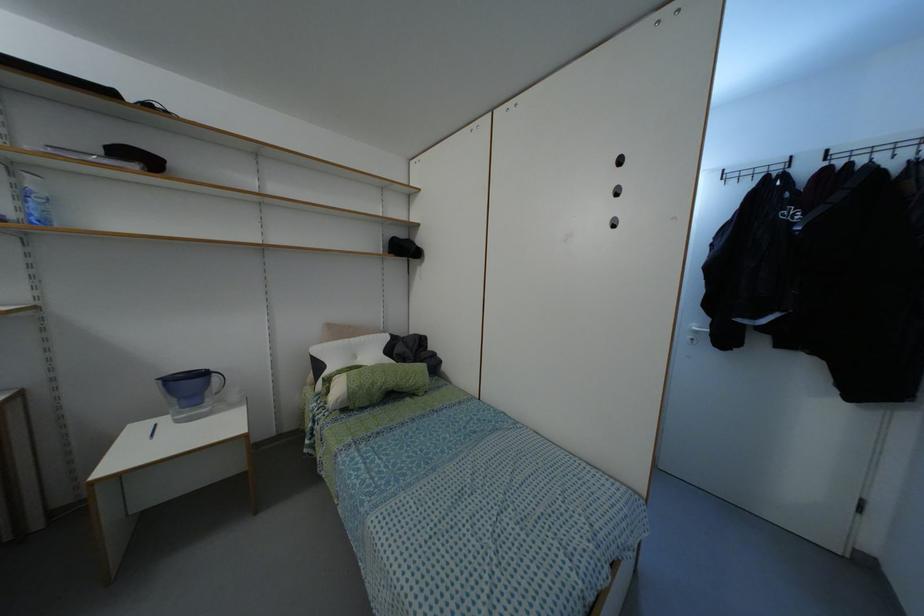
You are a GUI agent. You are given a task and a screenshot of the screen. Output one action in this format:
    pyautogui.click(x=<x>, y=<y>)
    Task: Click on the circular wall handle
    The height and width of the screenshot is (616, 924).
    Given the screenshot: What is the action you would take?
    pyautogui.click(x=508, y=367)